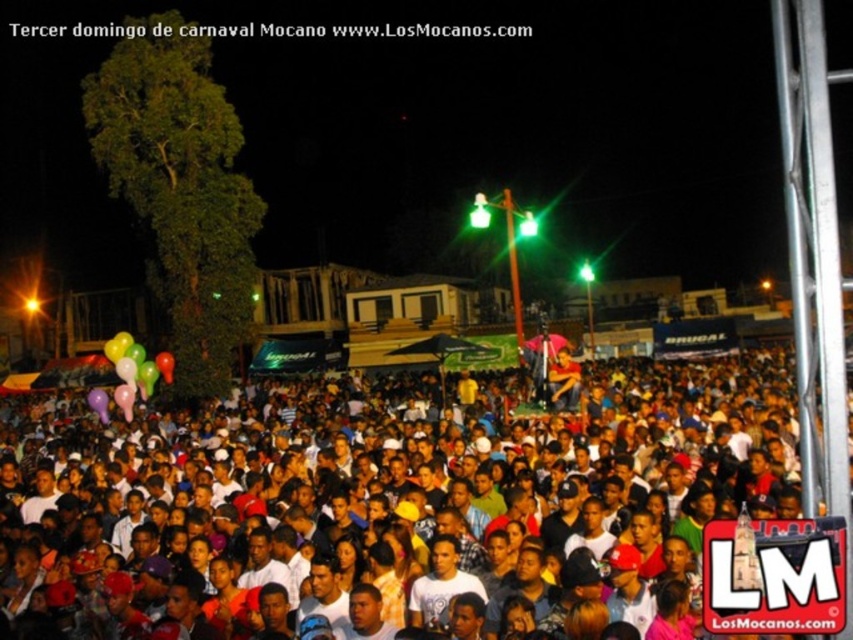
Question: Which of the following is the farthest from the observer?

Choices:
 (A) (125, 401)
 (B) (512, 490)

Answer: (A)

Question: Which object appears farthest from the camera in this image?

Choices:
 (A) rubber balloons at lower left
 (B) multicolored balloons at lower center

Answer: (A)

Question: Observing the image, what is the correct spatial positioning of multicolored balloons at lower center in reference to rubber balloons at lower left?

Choices:
 (A) above
 (B) below

Answer: (B)

Question: Where is multicolored balloons at lower center located in relation to rubber balloons at lower left in the image?

Choices:
 (A) right
 (B) left

Answer: (A)

Question: Is multicolored balloons at lower center smaller than rubber balloons at lower left?

Choices:
 (A) no
 (B) yes

Answer: (A)